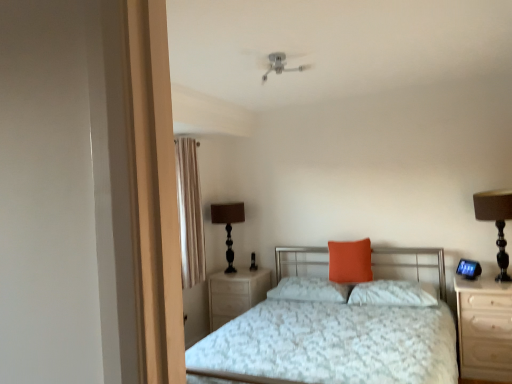
Question: In the image, is black glass table lamp at center left, which is the first table lamp in left-to-right order, on the left side or the right side of light wood/wooden nightstand at center, placed as the 2th nightstand when sorted from right to left?

Choices:
 (A) left
 (B) right

Answer: (A)

Question: Is black glass table lamp at center left, which is the 2th table lamp from right to left, spatially inside light wood/wooden nightstand at center, the first nightstand positioned from the left, or outside of it?

Choices:
 (A) inside
 (B) outside

Answer: (B)

Question: Estimate the real-world distances between objects in this image. Which object is closer to the light wood/wooden nightstand at right, the 2th nightstand from the left?

Choices:
 (A) orange fabric pillow at center, which is the 1th pillow in left-to-right order
 (B) white textured bed at center
 (C) light wood/wooden nightstand at center, which is the second nightstand in front-to-back order
 (D) beige fabric curtain at left
 (E) black glass table lamp at center left, which is the 2th table lamp from right to left

Answer: (B)

Question: Considering the real-world distances, which object is closest to the orange fabric pillow at center, which is the 2th pillow from left to right?

Choices:
 (A) black glass table lamp at center left, which appears as the 2th table lamp when viewed from the front
 (B) beige fabric curtain at left
 (C) light wood/wooden nightstand at right, which is the 1th nightstand from front to back
 (D) orange fabric pillow at center, which is the 1th pillow in left-to-right order
 (E) white textured bed at center

Answer: (D)